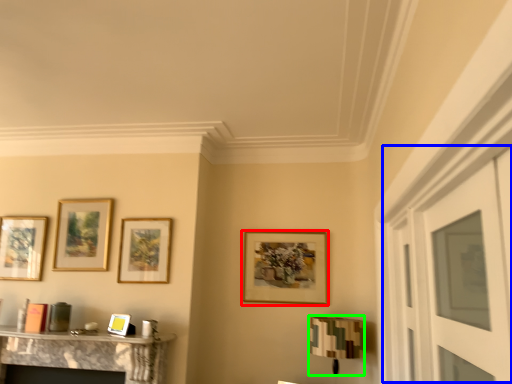
Question: Estimate the real-world distances between objects in this image. Which object is closer to picture frame (highlighted by a red box), glass door (highlighted by a blue box) or lamp (highlighted by a green box)?

Choices:
 (A) glass door
 (B) lamp

Answer: (B)